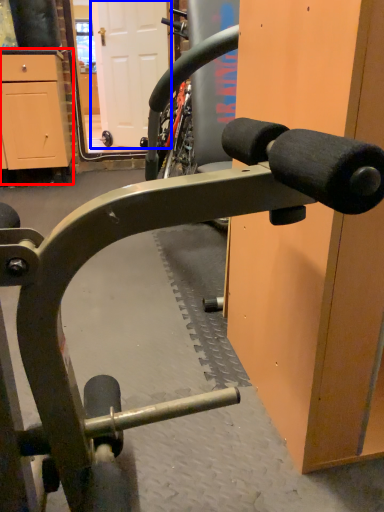
Question: Which object appears closest to the camera in this image, cabinetry (highlighted by a red box) or door (highlighted by a blue box)?

Choices:
 (A) cabinetry
 (B) door

Answer: (A)